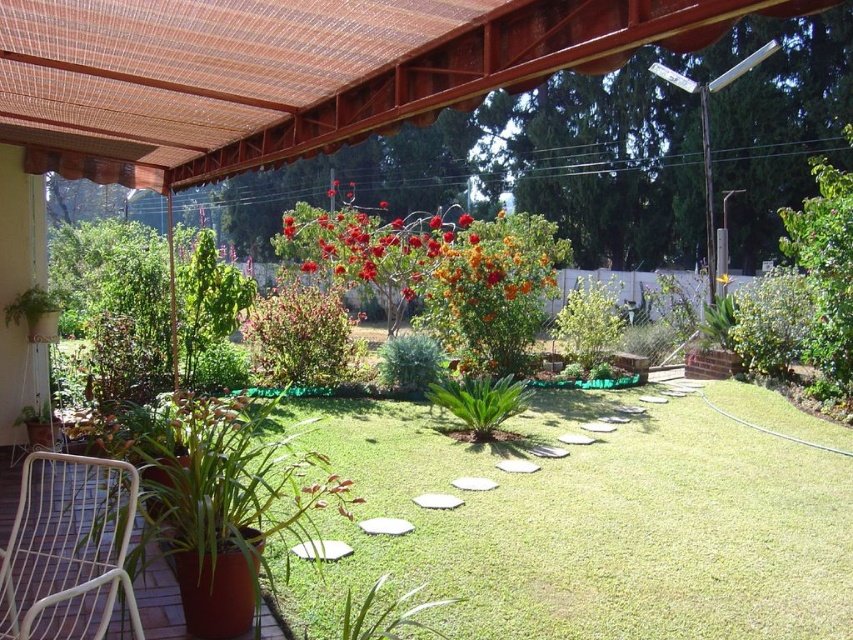
Question: From the image, what is the correct spatial relationship of white wicker chair at lower left in relation to yellow matte flower at center?

Choices:
 (A) right
 (B) left

Answer: (B)

Question: Among these points, which one is nearest to the camera?

Choices:
 (A) (154, 131)
 (B) (729, 282)

Answer: (A)

Question: Can you confirm if brown woven pergola at upper center is positioned below vibrant orange petals at center?

Choices:
 (A) yes
 (B) no

Answer: (A)

Question: Does white wicker chair at lower left have a lesser width compared to vibrant orange petals at center?

Choices:
 (A) no
 (B) yes

Answer: (B)

Question: Which object is positioned closest to the brown woven pergola at upper center?

Choices:
 (A) yellow matte flower at center
 (B) vibrant orange petals at center

Answer: (B)

Question: Which point appears farthest from the camera in this image?

Choices:
 (A) (35, 129)
 (B) (724, 275)
 (C) (126, 529)
 (D) (361, 230)

Answer: (B)